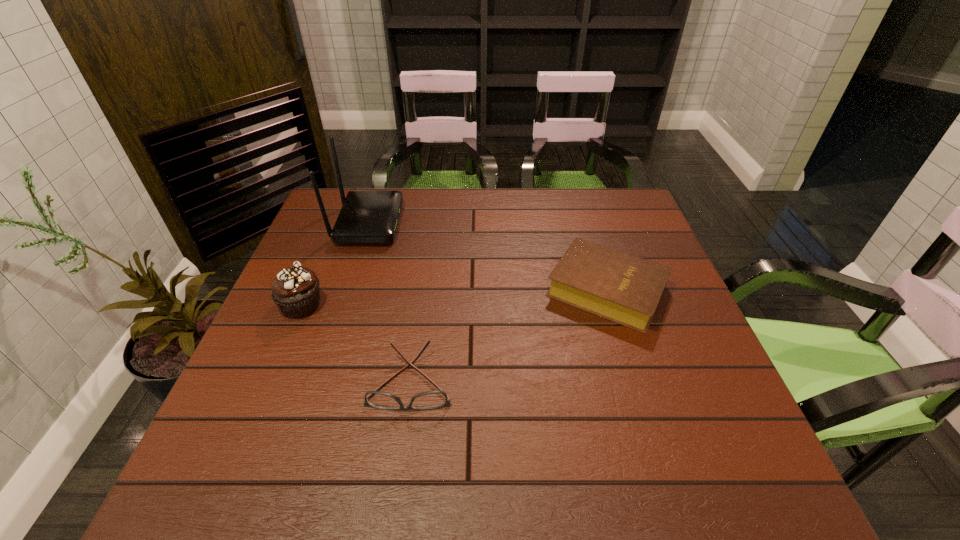
Identify the location of vacant space in between the rightmost object and the farthest object. (488, 256).

Identify the location of object that is the closest to the third object from left to right. (295, 291).

Image resolution: width=960 pixels, height=540 pixels. Identify the location of object that stands as the second closest to the second tallest object. (427, 400).

What are the coordinates of `free location that satisfies the following two spatial constraints: 1. on the back side of the second shortest object; 2. on the front-facing side of the tallest object` in the screenshot? It's located at (586, 223).

The width and height of the screenshot is (960, 540). I want to click on vacant space that satisfies the following two spatial constraints: 1. on the front-facing side of the router; 2. on the back side of the Bible, so click(x=347, y=290).